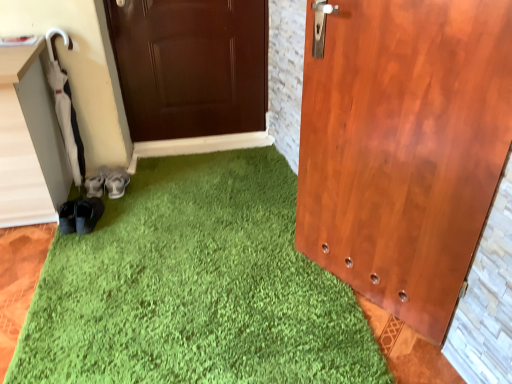
Question: From their relative heights in the image, would you say suede gray shoes at lower left, the 1th footwear viewed from the left, is taller or shorter than gray fabric shoes at lower left, positioned as the first footwear in right-to-left order?

Choices:
 (A) short
 (B) tall

Answer: (B)

Question: Considering the relative positions of suede gray shoes at lower left, the 1th footwear viewed from the left, and gray fabric shoes at lower left, positioned as the first footwear in right-to-left order, in the image provided, is suede gray shoes at lower left, the 1th footwear viewed from the left, to the left or to the right of gray fabric shoes at lower left, positioned as the first footwear in right-to-left order,?

Choices:
 (A) left
 (B) right

Answer: (A)

Question: Is suede gray shoes at lower left, the 1th footwear viewed from the left, inside or outside of gray fabric shoes at lower left, positioned as the first footwear in right-to-left order?

Choices:
 (A) inside
 (B) outside

Answer: (B)

Question: Is gray fabric shoes at lower left, positioned as the first footwear in right-to-left order, wider or thinner than suede gray shoes at lower left, the 1th footwear viewed from the left?

Choices:
 (A) thin
 (B) wide

Answer: (B)

Question: Considering the positions of gray fabric shoes at lower left, positioned as the first footwear in right-to-left order, and suede gray shoes at lower left, the 1th footwear viewed from the left, in the image, is gray fabric shoes at lower left, positioned as the first footwear in right-to-left order, taller or shorter than suede gray shoes at lower left, the 1th footwear viewed from the left,?

Choices:
 (A) short
 (B) tall

Answer: (A)

Question: In terms of size, does gray fabric shoes at lower left, positioned as the first footwear in right-to-left order, appear bigger or smaller than suede gray shoes at lower left, the 1th footwear viewed from the left?

Choices:
 (A) big
 (B) small

Answer: (A)

Question: Would you say gray fabric shoes at lower left, which ranks as the second footwear in left-to-right order, is to the left or to the right of suede gray shoes at lower left, the 1th footwear viewed from the left, in the picture?

Choices:
 (A) right
 (B) left

Answer: (A)